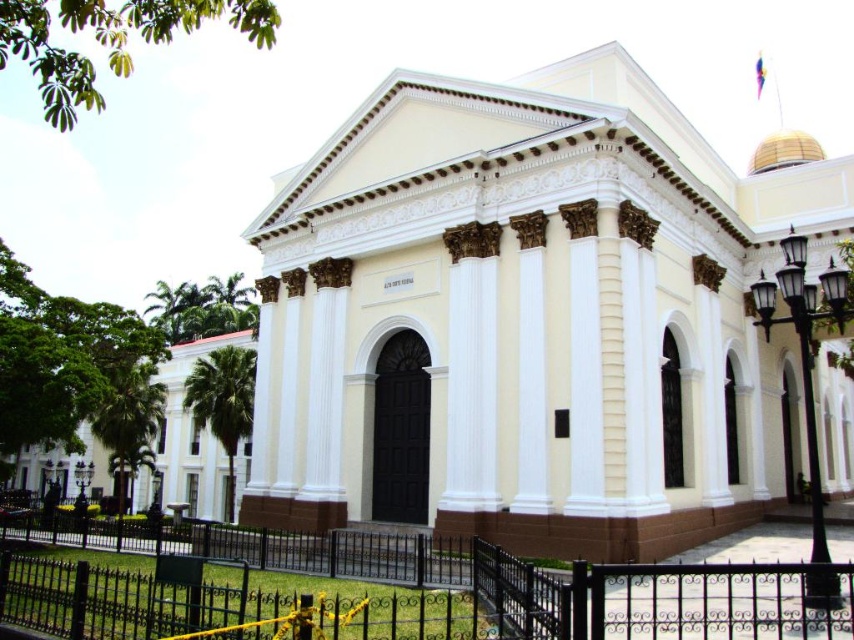
Can you confirm if white smooth building at center is thinner than black wrought iron fence at lower center?

No, white smooth building at center is not thinner than black wrought iron fence at lower center.

Is point (443, 445) positioned after point (592, 595)?

Yes.

The width and height of the screenshot is (854, 640). Describe the element at coordinates (531, 317) in the screenshot. I see `white smooth building at center` at that location.

This screenshot has width=854, height=640. I want to click on white smooth building at center, so click(531, 317).